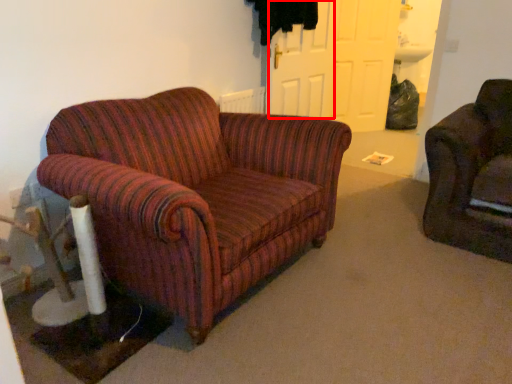
Question: Observing the image, what is the correct spatial positioning of door (annotated by the red box) in reference to door?

Choices:
 (A) right
 (B) left

Answer: (B)